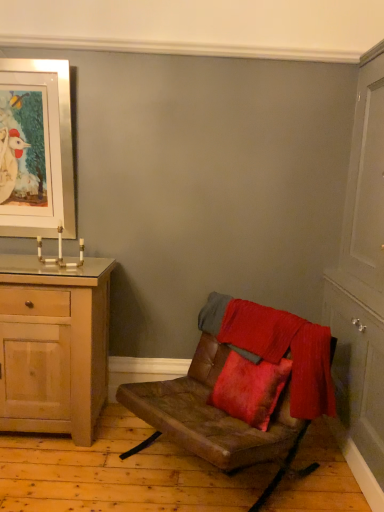
What is the approximate height of white wood cabinet at right?

white wood cabinet at right is 2.19 meters in height.

Where is `light wood cabinet at left`? This screenshot has width=384, height=512. light wood cabinet at left is located at coordinates (53, 346).

Find the location of `leather cushion at center`. leather cushion at center is located at coordinates (215, 404).

Identify the location of blanket below the silver metallic picture frame at upper left (from a real-world perspective). This screenshot has width=384, height=512. (277, 347).

Are silver metallic picture frame at upper left and velvet red blanket at center located far from each other?

Indeed, silver metallic picture frame at upper left is not near velvet red blanket at center.

Is silver metallic picture frame at upper left aimed at velvet red blanket at center?

No, silver metallic picture frame at upper left does not turn towards velvet red blanket at center.

Which of these two, silver metallic picture frame at upper left or velvet red blanket at center, is wider?

velvet red blanket at center.

Can you confirm if leather cushion at center is shorter than velvet red blanket at center?

In fact, leather cushion at center may be taller than velvet red blanket at center.

Is leather cushion at center outside of velvet red blanket at center?

Yes, leather cushion at center is located beyond the bounds of velvet red blanket at center.

Between leather cushion at center and velvet red blanket at center, which one appears on the left side from the viewer's perspective?

leather cushion at center is more to the left.

Could you tell me if leather cushion at center is turned towards velvet red blanket at center?

No, leather cushion at center does not turn towards velvet red blanket at center.

Between silver metallic picture frame at upper left and leather cushion at center, which one has smaller size?

silver metallic picture frame at upper left.

Considering the relative sizes of silver metallic picture frame at upper left and leather cushion at center in the image provided, is silver metallic picture frame at upper left thinner than leather cushion at center?

Yes, silver metallic picture frame at upper left is thinner than leather cushion at center.

Would you say silver metallic picture frame at upper left contains leather cushion at center?

No.

Is silver metallic picture frame at upper left facing towards leather cushion at center?

No, silver metallic picture frame at upper left is not facing towards leather cushion at center.

Considering the positions of objects white wood cabinet at right and silver metallic picture frame at upper left in the image provided, who is more to the right, white wood cabinet at right or silver metallic picture frame at upper left?

white wood cabinet at right is more to the right.

From a real-world perspective, is white wood cabinet at right physically below silver metallic picture frame at upper left?

Yes.

From the image's perspective, which object appears higher, white wood cabinet at right or silver metallic picture frame at upper left?

silver metallic picture frame at upper left is shown above in the image.

Is white wood cabinet at right not within silver metallic picture frame at upper left?

Yes.

Could you tell me if velvet red blanket at center is turned towards light wood cabinet at left?

No, velvet red blanket at center is not aimed at light wood cabinet at left.

I want to click on chest of drawers located on the left of velvet red blanket at center, so click(x=53, y=346).

Which of these two, velvet red blanket at center or light wood cabinet at left, stands taller?

light wood cabinet at left.

From the picture: Is velvet red blanket at center behind light wood cabinet at left?

No, velvet red blanket at center is closer to the viewer.

Is velvet red blanket at center behind white wood cabinet at right?

Yes.

From a real-world perspective, is velvet red blanket at center positioned above or below white wood cabinet at right?

Clearly, from a real-world perspective, velvet red blanket at center is below white wood cabinet at right.

Is velvet red blanket at center directly adjacent to white wood cabinet at right?

velvet red blanket at center and white wood cabinet at right are not in contact.

Does velvet red blanket at center contain white wood cabinet at right?

That's incorrect, white wood cabinet at right is not inside velvet red blanket at center.

Is leather cushion at center in front of light wood cabinet at left?

Yes, leather cushion at center is closer to the viewer.

Where is `chair on the right of light wood cabinet at left`? chair on the right of light wood cabinet at left is located at coordinates (215, 404).

From a real-world perspective, is leather cushion at center above or below light wood cabinet at left?

From a real-world perspective, leather cushion at center is physically below light wood cabinet at left.

I want to click on blanket that is in front of the silver metallic picture frame at upper left, so click(x=277, y=347).

Where is `blanket above the leather cushion at center (from a real-world perspective)`? Image resolution: width=384 pixels, height=512 pixels. blanket above the leather cushion at center (from a real-world perspective) is located at coordinates point(277,347).

Estimate the real-world distances between objects in this image. Which object is closer to light wood cabinet at left, leather cushion at center or silver metallic picture frame at upper left?

leather cushion at center.

Based on their spatial positions, is light wood cabinet at left or leather cushion at center further from white wood cabinet at right?

light wood cabinet at left.

When comparing their distances from silver metallic picture frame at upper left, does velvet red blanket at center or white wood cabinet at right seem closer?

velvet red blanket at center lies closer to silver metallic picture frame at upper left than the other object.

From the picture: When comparing their distances from silver metallic picture frame at upper left, does white wood cabinet at right or light wood cabinet at left seem further?

white wood cabinet at right is further to silver metallic picture frame at upper left.

Looking at this image, which object lies nearer to the anchor point leather cushion at center, light wood cabinet at left or velvet red blanket at center?

The object closer to leather cushion at center is velvet red blanket at center.

Which object lies nearer to the anchor point silver metallic picture frame at upper left, leather cushion at center or white wood cabinet at right?

leather cushion at center lies closer to silver metallic picture frame at upper left than the other object.

From the image, which object appears to be farther from leather cushion at center, silver metallic picture frame at upper left or white wood cabinet at right?

The object further to leather cushion at center is silver metallic picture frame at upper left.

Which object lies nearer to the anchor point white wood cabinet at right, velvet red blanket at center or light wood cabinet at left?

The object closer to white wood cabinet at right is velvet red blanket at center.

Find the location of a particular element. This screenshot has width=384, height=512. chair between silver metallic picture frame at upper left and white wood cabinet at right is located at coordinates (215, 404).

Locate an element on the screen. The width and height of the screenshot is (384, 512). blanket between silver metallic picture frame at upper left and leather cushion at center from top to bottom is located at coordinates (277, 347).

Locate an element on the screen. The image size is (384, 512). blanket located between light wood cabinet at left and white wood cabinet at right in the left-right direction is located at coordinates (277, 347).

At what (x,y) coordinates should I click in order to perform the action: click on the chest of drawers situated between silver metallic picture frame at upper left and white wood cabinet at right from left to right. Please return your answer as a coordinate pair (x, y). This screenshot has width=384, height=512. Looking at the image, I should click on (53, 346).